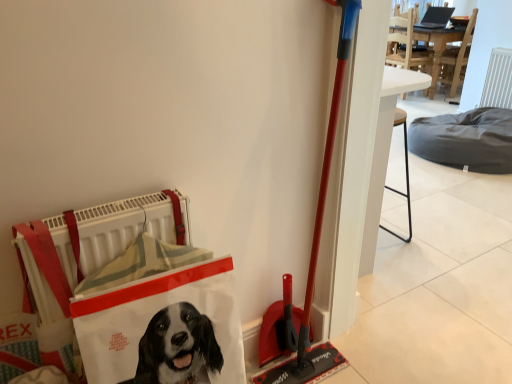
Question: From the image's perspective, is dark gray fabric dog bed at center-right above or below white fabric shopping bag at lower left?

Choices:
 (A) above
 (B) below

Answer: (A)

Question: In terms of width, does dark gray fabric dog bed at center-right look wider or thinner when compared to white fabric shopping bag at lower left?

Choices:
 (A) thin
 (B) wide

Answer: (B)

Question: Is point 458,125 positioned closer to the camera than point 212,261?

Choices:
 (A) farther
 (B) closer

Answer: (A)

Question: From the image's perspective, relative to dark gray fabric dog bed at center-right, is white fabric shopping bag at lower left above or below?

Choices:
 (A) below
 (B) above

Answer: (A)

Question: Visually, is white fabric shopping bag at lower left positioned to the left or to the right of dark gray fabric dog bed at center-right?

Choices:
 (A) left
 (B) right

Answer: (A)

Question: Looking at the image, does white fabric shopping bag at lower left seem bigger or smaller compared to dark gray fabric dog bed at center-right?

Choices:
 (A) big
 (B) small

Answer: (B)

Question: Is point (182, 350) positioned closer to the camera than point (505, 152)?

Choices:
 (A) closer
 (B) farther

Answer: (A)